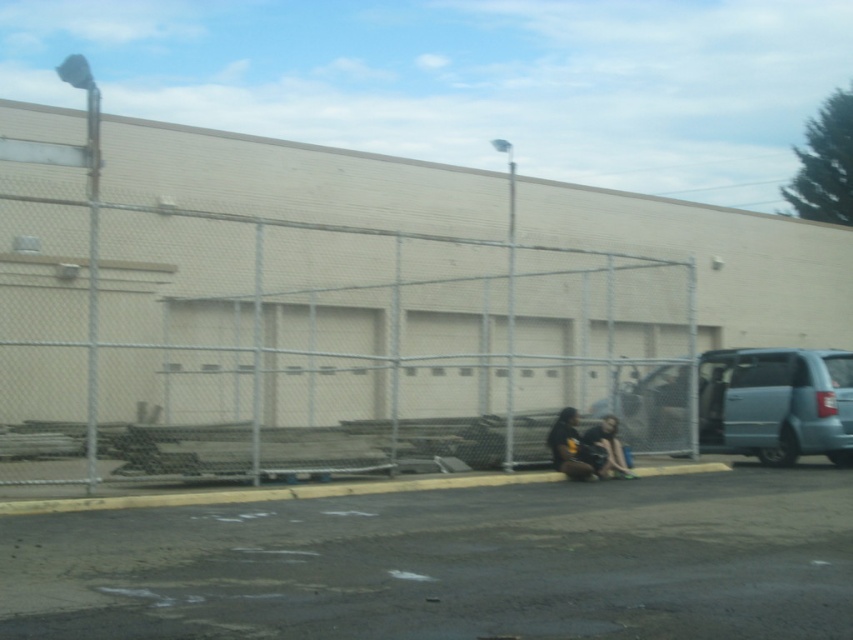
You are standing at the point with coordinates (309, 342) in the urban scene. What object are you standing on?

The point at coordinates (309, 342) corresponds to the metallic chainlink fence at center, so you are standing on the metallic chainlink fence at center.

You are a delivery person who needs to place a package on the gray concrete curb at lower center. However, there is a black matte shirt at center in the way. Can you place the package on the curb without moving the shirt?

The gray concrete curb at lower center is shorter than the black matte shirt at center, so the shirt is taller and likely blocking the curb. You would need to move the shirt to place the package there.

Consider the image. You are standing at the point marked by the coordinates point (270, 492). Looking around, you see a gray concrete curb at lower center. What object is exactly at your current location?

The gray concrete curb at lower center is located at point (270, 492).